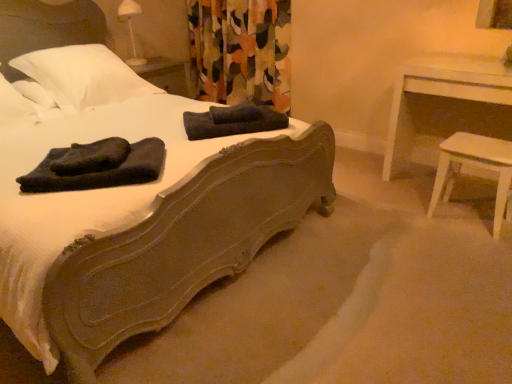
Question: Considering their positions, is white wood table at right located in front of or behind dark gray cotton bath towel at center, positioned as the third bath towel in front-to-back order?

Choices:
 (A) behind
 (B) front

Answer: (A)

Question: From the image's perspective, is white wood table at right located above or below dark gray cotton bath towel at center, positioned as the third bath towel in front-to-back order?

Choices:
 (A) below
 (B) above

Answer: (B)

Question: Which is nearer to the white wood table at right?

Choices:
 (A) floral fabric curtain at center
 (B) matte brown bed at center
 (C) black cotton bath towel at left, acting as the 2th bath towel starting from the back
 (D) dark gray cotton bath towel at center, the 1th bath towel from the back
 (E) dark blue fleece bath towel at center, the 3th bath towel viewed from the back

Answer: (D)

Question: Estimate the real-world distances between objects in this image. Which object is farther from the white wood stool at right?

Choices:
 (A) white soft pillow at upper left, the first pillow positioned from the right
 (B) dark gray cotton bath towel at center, the 1th bath towel from the back
 (C) white wood table at right
 (D) dark blue fleece bath towel at center, the 3th bath towel viewed from the back
 (E) matte brown bed at center

Answer: (A)